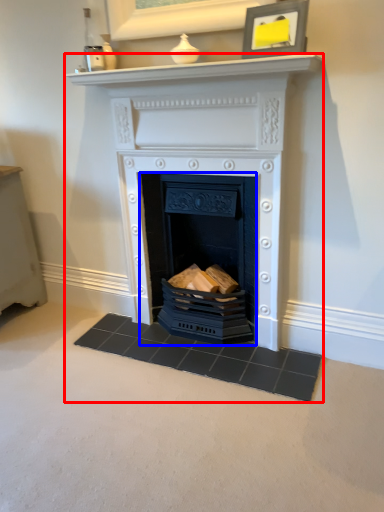
Question: Among these objects, which one is farthest to the camera, fireplace (highlighted by a red box) or fireplace (highlighted by a blue box)?

Choices:
 (A) fireplace
 (B) fireplace

Answer: (B)